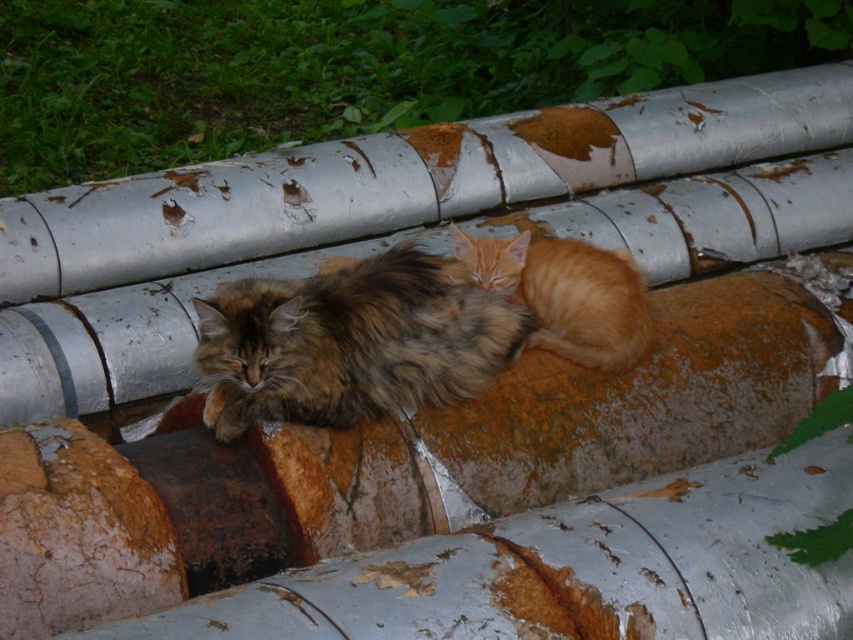
Can you confirm if brown fur cat at center is positioned to the left of orange fur/kitten at center?

Indeed, brown fur cat at center is positioned on the left side of orange fur/kitten at center.

Can you confirm if brown fur cat at center is taller than orange fur/kitten at center?

Indeed, brown fur cat at center has a greater height compared to orange fur/kitten at center.

Who is more distant from viewer, (212, 352) or (543, 285)?

Point (543, 285)

You are a GUI agent. You are given a task and a screenshot of the screen. Output one action in this format:
    pyautogui.click(x=<x>, y=<y>)
    Task: Click on the brown fur cat at center
    
    Given the screenshot: What is the action you would take?
    pyautogui.click(x=351, y=342)